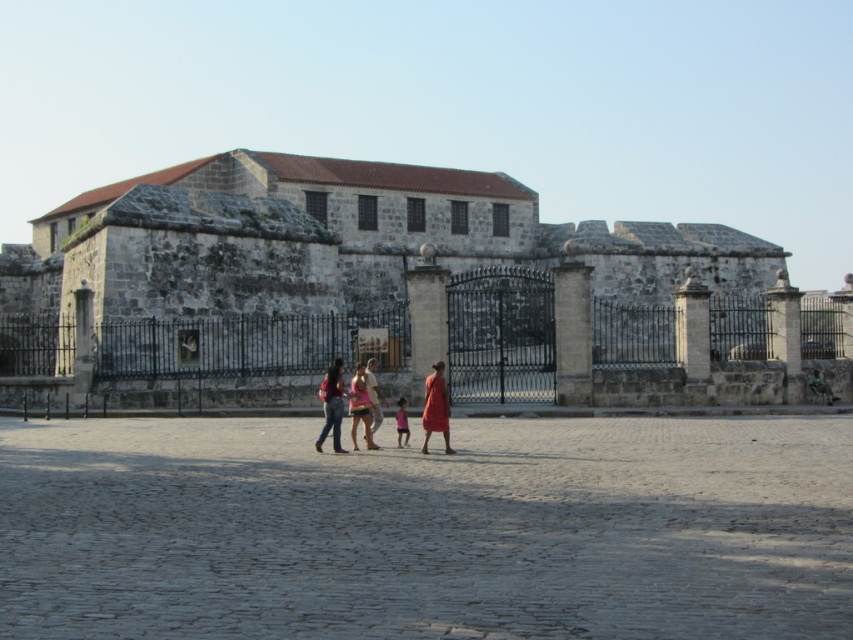
You are a photographer planning to take a group photo of two people wearing the matte pink shorts at center and the matte orange dress at center. The camera frame can only accommodate a total width of 1.2 meters. Given that the combined width of both outfits must not exceed this limit, can both individuals stand side by side within the frame?

The matte pink shorts at center is wider than the matte orange dress at center. However, without knowing their exact widths, it is impossible to determine if their combined width exceeds 1.2 meters. Additional measurements are required to confirm.

You are standing in front of the historical stone building with the black wrought iron gate. You see a point at coordinates (360, 406). What object is located at that point?

The point at coordinates (360, 406) corresponds to matte pink shorts at center.